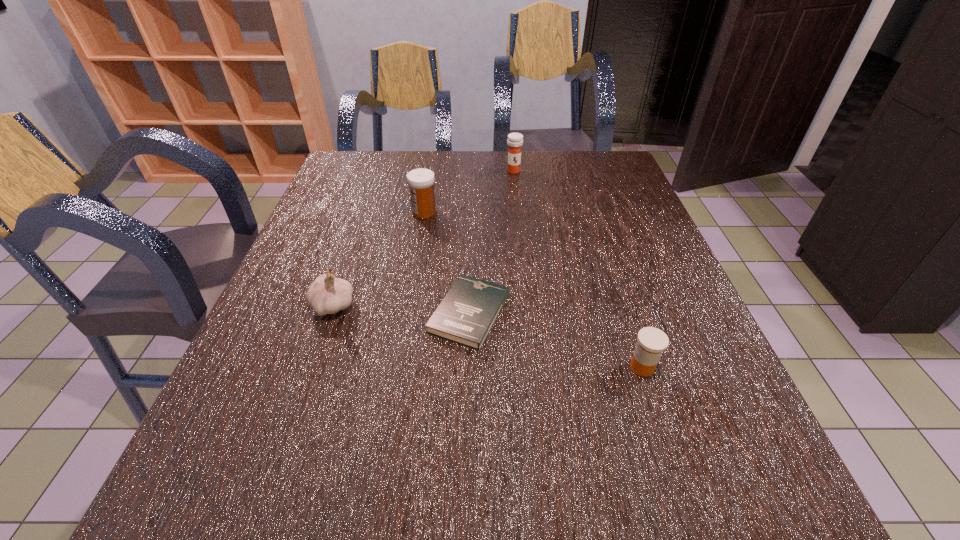
Locate an element on the screen. vacant space that satisfies the following two spatial constraints: 1. on the front side of the second object from left to right; 2. on the left side of the book is located at coordinates (407, 313).